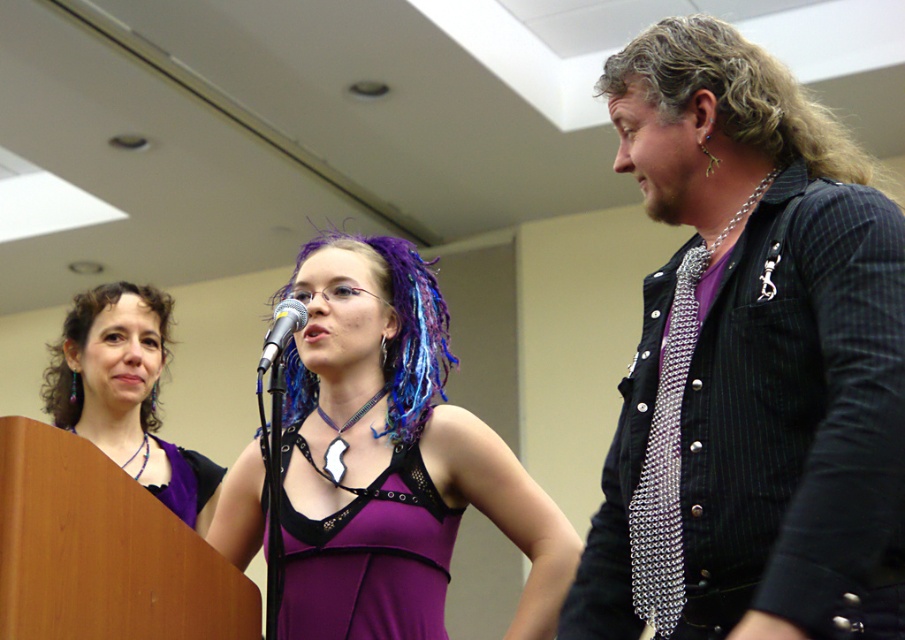
You are an event planner who needs to adjust the lighting for the speakers. The purple satin dress at center and the metallic silver microphone at center are both in the spotlight. Which object is positioned lower in the frame?

The purple satin dress at center is located below the metallic silver microphone at center, so it is positioned lower in the frame.

You are an event photographer positioned at the back of the room. You need to capture a clear photo of both the purple matte dress at center and the purple fabric dress at left. Which dress will appear larger in your photo?

The purple matte dress at center will appear larger in the photo because it is closer to the viewer than the purple fabric dress at left.